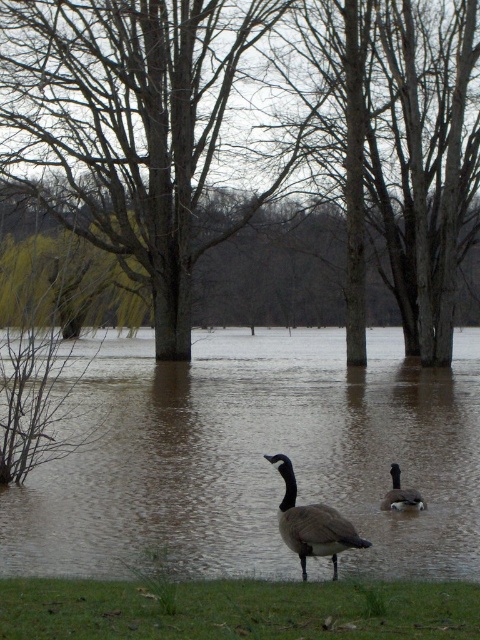
You are a photographer trying to capture a photo of the flooded area. You notice two points in the scene at coordinates point (82, 220) and point (136, 584). Which point is closer to your camera position?

Point (136, 584) is closer to the camera position because it is less further than point (82, 220).